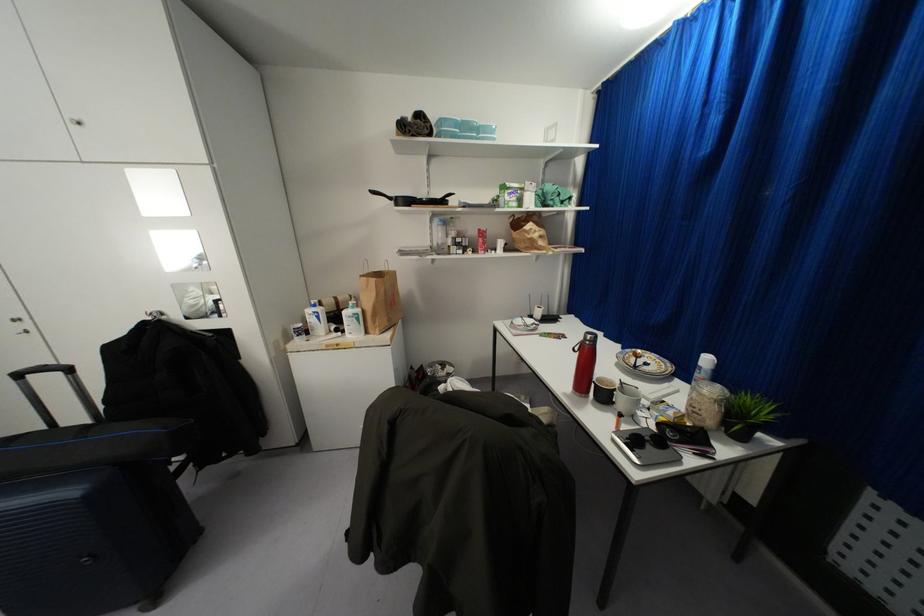
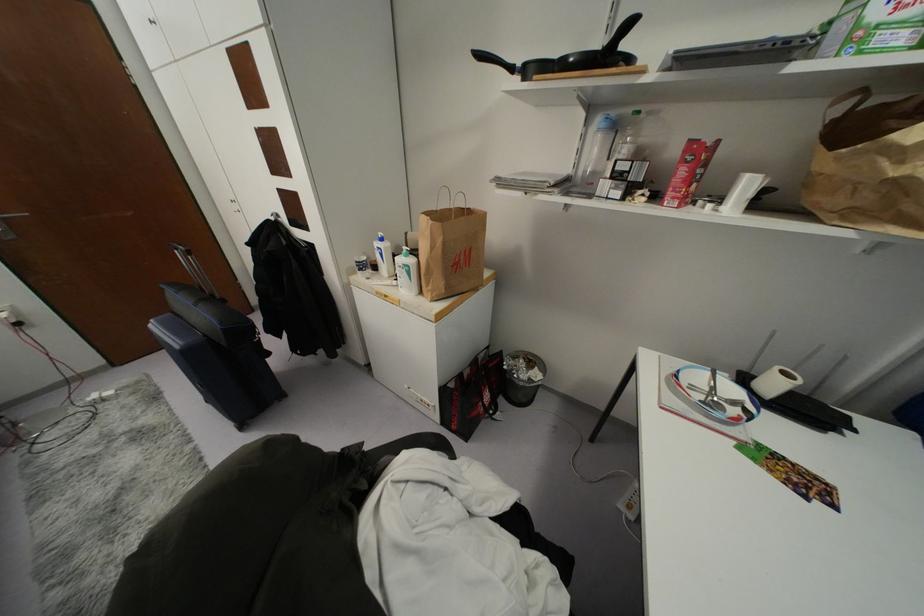
Question: I am providing you with two images of the same scene from different viewpoints. After the viewpoint changes to image2, which objects are now occluded?

Choices:
 (A) paper towel roll
 (B) suitcase telescoping handle
 (C) clear water bottle
 (D) none of these

Answer: (D)